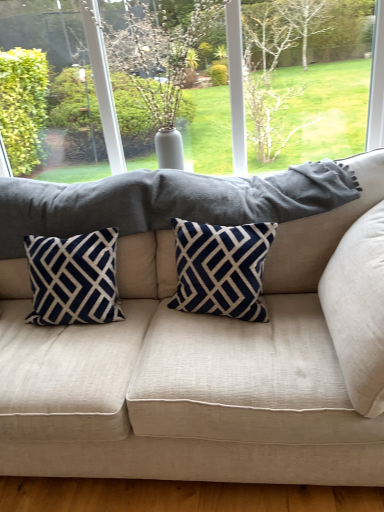
In order to click on green leafy tree at upper center in this screenshot , I will do `click(149, 65)`.

The height and width of the screenshot is (512, 384). Find the location of `beige fabric pillow at right, which ranks as the 3th pillow in left-to-right order`. beige fabric pillow at right, which ranks as the 3th pillow in left-to-right order is located at coordinates (358, 310).

Measure the distance between point (361, 244) and camera.

The distance of point (361, 244) from camera is 4.54 feet.

Locate an element on the screen. The height and width of the screenshot is (512, 384). beige fabric couch at center is located at coordinates (192, 374).

Considering the relative sizes of beige fabric pillow at right, which ranks as the 3th pillow in left-to-right order, and beige fabric couch at center in the image provided, is beige fabric pillow at right, which ranks as the 3th pillow in left-to-right order, wider than beige fabric couch at center?

No.

Is point (347, 257) closer to viewer compared to point (88, 443)?

No, (347, 257) is behind (88, 443).

Can you confirm if beige fabric pillow at right, which ranks as the 3th pillow in left-to-right order, is shorter than beige fabric couch at center?

A: Correct, beige fabric pillow at right, which ranks as the 3th pillow in left-to-right order, is not as tall as beige fabric couch at center.

Based on the photo, is beige fabric pillow at right, arranged as the first pillow when viewed from the right, looking in the opposite direction of navy blue velvet pillow at center, placed as the second pillow when sorted from left to right?

Absolutely, beige fabric pillow at right, arranged as the first pillow when viewed from the right, is directed away from navy blue velvet pillow at center, placed as the second pillow when sorted from left to right.

Can you tell me how much beige fabric pillow at right, which ranks as the 3th pillow in left-to-right order, and navy blue velvet pillow at center, the 2th pillow in the right-to-left sequence, differ in facing direction?

94.7 degrees.

Consider the image. Could you measure the distance between beige fabric pillow at right, arranged as the first pillow when viewed from the right, and navy blue velvet pillow at center, placed as the second pillow when sorted from left to right?

15.53 inches.

Does beige fabric pillow at right, which ranks as the 3th pillow in left-to-right order, contain navy blue velvet pillow at center, the 2th pillow in the right-to-left sequence?

No, navy blue velvet pillow at center, the 2th pillow in the right-to-left sequence, is located outside of beige fabric pillow at right, which ranks as the 3th pillow in left-to-right order.

Is beige fabric couch at center to the left of green leafy tree at upper center from the viewer's perspective?

Yes.

Is beige fabric couch at center facing towards green leafy tree at upper center?

No, beige fabric couch at center is not turned towards green leafy tree at upper center.

Locate an element on the screen. The height and width of the screenshot is (512, 384). tree located above the beige fabric couch at center (from the image's perspective) is located at coordinates (149, 65).

From the picture: Relative to green leafy tree at upper center, is beige fabric couch at center in front or behind?

beige fabric couch at center is in front of green leafy tree at upper center.

Looking at this image, is navy blue velvet pillow at center, the 2th pillow in the right-to-left sequence, far away from green leafy tree at upper center?

No, navy blue velvet pillow at center, the 2th pillow in the right-to-left sequence, is not far away from green leafy tree at upper center.

From the image's perspective, who appears lower, navy blue velvet pillow at center, placed as the second pillow when sorted from left to right, or green leafy tree at upper center?

navy blue velvet pillow at center, placed as the second pillow when sorted from left to right.

Considering the sizes of objects navy blue velvet pillow at center, placed as the second pillow when sorted from left to right, and green leafy tree at upper center in the image provided, who is wider, navy blue velvet pillow at center, placed as the second pillow when sorted from left to right, or green leafy tree at upper center?

With larger width is green leafy tree at upper center.

Considering the relative positions of navy blue velvet pillow at center, the 2th pillow in the right-to-left sequence, and green leafy tree at upper center in the image provided, is navy blue velvet pillow at center, the 2th pillow in the right-to-left sequence, to the left or to the right of green leafy tree at upper center?

From the image, it's evident that navy blue velvet pillow at center, the 2th pillow in the right-to-left sequence, is to the right of green leafy tree at upper center.

Is navy velvet pillow at left, which ranks as the 3th pillow in right-to-left order, further to the viewer compared to navy blue velvet pillow at center, the 2th pillow in the right-to-left sequence?

Yes, it is behind navy blue velvet pillow at center, the 2th pillow in the right-to-left sequence.

Do you think navy velvet pillow at left, which ranks as the 3th pillow in right-to-left order, is within navy blue velvet pillow at center, placed as the second pillow when sorted from left to right, or outside of it?

navy velvet pillow at left, which ranks as the 3th pillow in right-to-left order, lies outside navy blue velvet pillow at center, placed as the second pillow when sorted from left to right.

Which is more to the left, navy velvet pillow at left, arranged as the 1th pillow when viewed from the left, or navy blue velvet pillow at center, placed as the second pillow when sorted from left to right?

navy velvet pillow at left, arranged as the 1th pillow when viewed from the left.

Looking at this image, could you tell me if navy velvet pillow at left, arranged as the 1th pillow when viewed from the left, is facing navy blue velvet pillow at center, placed as the second pillow when sorted from left to right?

No, navy velvet pillow at left, arranged as the 1th pillow when viewed from the left, does not turn towards navy blue velvet pillow at center, placed as the second pillow when sorted from left to right.

From the image's perspective, is navy velvet pillow at left, which ranks as the 3th pillow in right-to-left order, positioned above or below beige fabric pillow at right, which ranks as the 3th pillow in left-to-right order?

Clearly, from the image's perspective, navy velvet pillow at left, which ranks as the 3th pillow in right-to-left order, is above beige fabric pillow at right, which ranks as the 3th pillow in left-to-right order.

Between point (54, 298) and point (336, 255), which one is positioned in front?

The point (336, 255) is closer.

Is navy velvet pillow at left, arranged as the 1th pillow when viewed from the left, facing towards beige fabric pillow at right, which ranks as the 3th pillow in left-to-right order?

No.

Which is in front, navy velvet pillow at left, arranged as the 1th pillow when viewed from the left, or beige fabric pillow at right, which ranks as the 3th pillow in left-to-right order?

beige fabric pillow at right, which ranks as the 3th pillow in left-to-right order.

From a real-world perspective, relative to navy velvet pillow at left, which ranks as the 3th pillow in right-to-left order, is beige fabric couch at center vertically above or below?

beige fabric couch at center is below navy velvet pillow at left, which ranks as the 3th pillow in right-to-left order.

Does beige fabric couch at center have a greater height compared to navy velvet pillow at left, arranged as the 1th pillow when viewed from the left?

Indeed, beige fabric couch at center has a greater height compared to navy velvet pillow at left, arranged as the 1th pillow when viewed from the left.

In the scene shown: Is beige fabric couch at center next to navy velvet pillow at left, arranged as the 1th pillow when viewed from the left, and touching it?

beige fabric couch at center and navy velvet pillow at left, arranged as the 1th pillow when viewed from the left, are clearly separated.

Where is `studio couch below the beige fabric pillow at right, which ranks as the 3th pillow in left-to-right order (from the image's perspective)`? The height and width of the screenshot is (512, 384). studio couch below the beige fabric pillow at right, which ranks as the 3th pillow in left-to-right order (from the image's perspective) is located at coordinates (192, 374).

Locate an element on the screen. pillow that is the 2nd one when counting upward from the beige fabric pillow at right, which ranks as the 3th pillow in left-to-right order (from the image's perspective) is located at coordinates (221, 269).

Based on their spatial positions, is beige fabric pillow at right, which ranks as the 3th pillow in left-to-right order, or beige fabric couch at center closer to navy blue velvet pillow at center, the 2th pillow in the right-to-left sequence?

Based on the image, beige fabric couch at center appears to be nearer to navy blue velvet pillow at center, the 2th pillow in the right-to-left sequence.

Which object lies nearer to the anchor point beige fabric couch at center, beige fabric pillow at right, which ranks as the 3th pillow in left-to-right order, or navy velvet pillow at left, which ranks as the 3th pillow in right-to-left order?

navy velvet pillow at left, which ranks as the 3th pillow in right-to-left order.

Estimate the real-world distances between objects in this image. Which object is closer to navy blue velvet pillow at center, the 2th pillow in the right-to-left sequence, green leafy tree at upper center or beige fabric couch at center?

beige fabric couch at center is closer to navy blue velvet pillow at center, the 2th pillow in the right-to-left sequence.

From the image, which object appears to be farther from navy blue velvet pillow at center, the 2th pillow in the right-to-left sequence, green leafy tree at upper center or navy velvet pillow at left, which ranks as the 3th pillow in right-to-left order?

The object further to navy blue velvet pillow at center, the 2th pillow in the right-to-left sequence, is green leafy tree at upper center.

When comparing their distances from navy velvet pillow at left, which ranks as the 3th pillow in right-to-left order, does navy blue velvet pillow at center, placed as the second pillow when sorted from left to right, or beige fabric pillow at right, which ranks as the 3th pillow in left-to-right order, seem further?

beige fabric pillow at right, which ranks as the 3th pillow in left-to-right order.

Looking at the image, which one is located further to navy velvet pillow at left, which ranks as the 3th pillow in right-to-left order, green leafy tree at upper center or beige fabric pillow at right, which ranks as the 3th pillow in left-to-right order?

Among the two, beige fabric pillow at right, which ranks as the 3th pillow in left-to-right order, is located further to navy velvet pillow at left, which ranks as the 3th pillow in right-to-left order.

When comparing their distances from beige fabric couch at center, does green leafy tree at upper center or beige fabric pillow at right, which ranks as the 3th pillow in left-to-right order, seem further?

green leafy tree at upper center lies further to beige fabric couch at center than the other object.

Considering their positions, is navy blue velvet pillow at center, placed as the second pillow when sorted from left to right, positioned further to beige fabric pillow at right, which ranks as the 3th pillow in left-to-right order, than beige fabric couch at center?

beige fabric couch at center is positioned further to the anchor beige fabric pillow at right, which ranks as the 3th pillow in left-to-right order.

Locate an element on the screen. tree between navy velvet pillow at left, arranged as the 1th pillow when viewed from the left, and beige fabric pillow at right, which ranks as the 3th pillow in left-to-right order, in the horizontal direction is located at coordinates (149, 65).

This screenshot has width=384, height=512. In order to click on pillow between navy velvet pillow at left, which ranks as the 3th pillow in right-to-left order, and beige fabric pillow at right, which ranks as the 3th pillow in left-to-right order, from left to right in this screenshot , I will do `click(221, 269)`.

Where is `pillow between green leafy tree at upper center and navy velvet pillow at left, which ranks as the 3th pillow in right-to-left order, in the vertical direction`? pillow between green leafy tree at upper center and navy velvet pillow at left, which ranks as the 3th pillow in right-to-left order, in the vertical direction is located at coordinates click(x=221, y=269).

At what (x,y) coordinates should I click in order to perform the action: click on pillow between beige fabric couch at center and beige fabric pillow at right, which ranks as the 3th pillow in left-to-right order, from left to right. Please return your answer as a coordinate pair (x, y). This screenshot has width=384, height=512. Looking at the image, I should click on (221, 269).